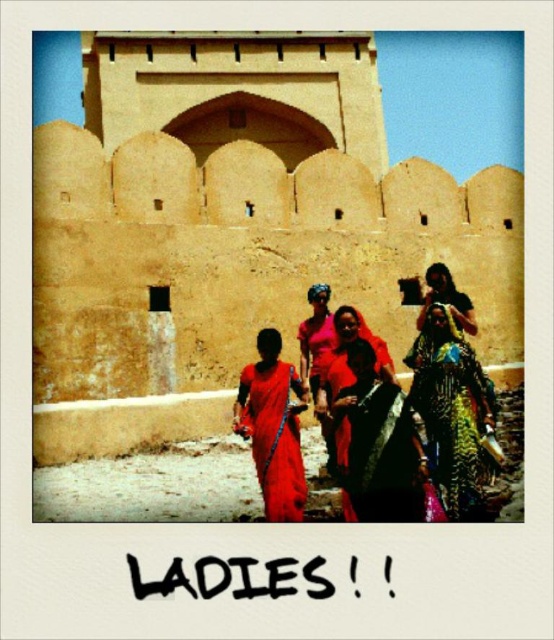
Question: Which point is closer to the camera?

Choices:
 (A) (428, 356)
 (B) (259, 387)

Answer: (B)

Question: From the image, what is the correct spatial relationship of beige stone wall at center in relation to matte red sari at center?

Choices:
 (A) above
 (B) below

Answer: (A)

Question: Is shiny gold dress at right bigger than matte red sari at center?

Choices:
 (A) no
 (B) yes

Answer: (A)

Question: Estimate the real-world distances between objects in this image. Which object is farther from the shiny gold dress at right?

Choices:
 (A) beige stone wall at center
 (B) matte red sari at center

Answer: (A)

Question: Is beige stone wall at center positioned behind shiny gold dress at right?

Choices:
 (A) no
 (B) yes

Answer: (B)

Question: Which point appears closest to the camera in this image?

Choices:
 (A) (212, 173)
 (B) (286, 365)

Answer: (B)